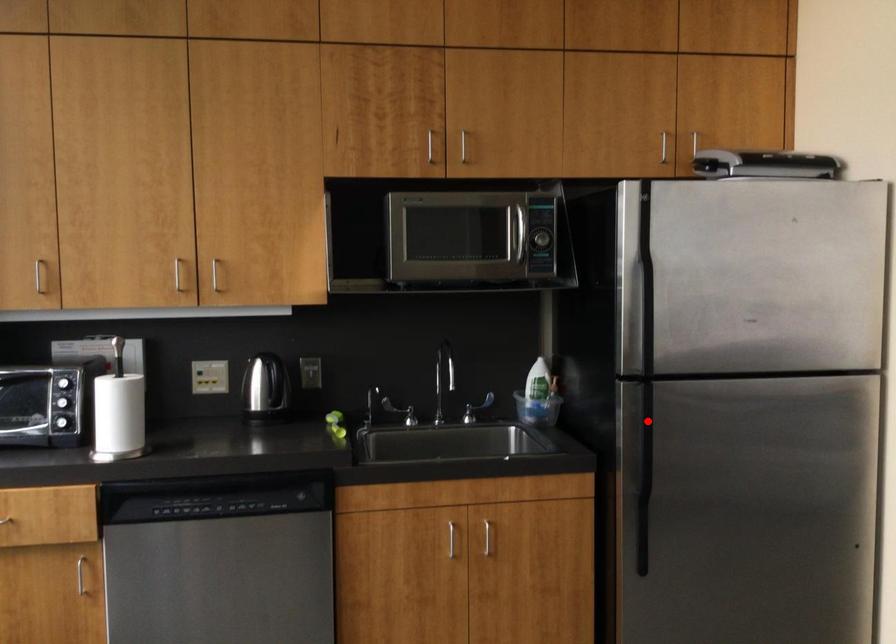
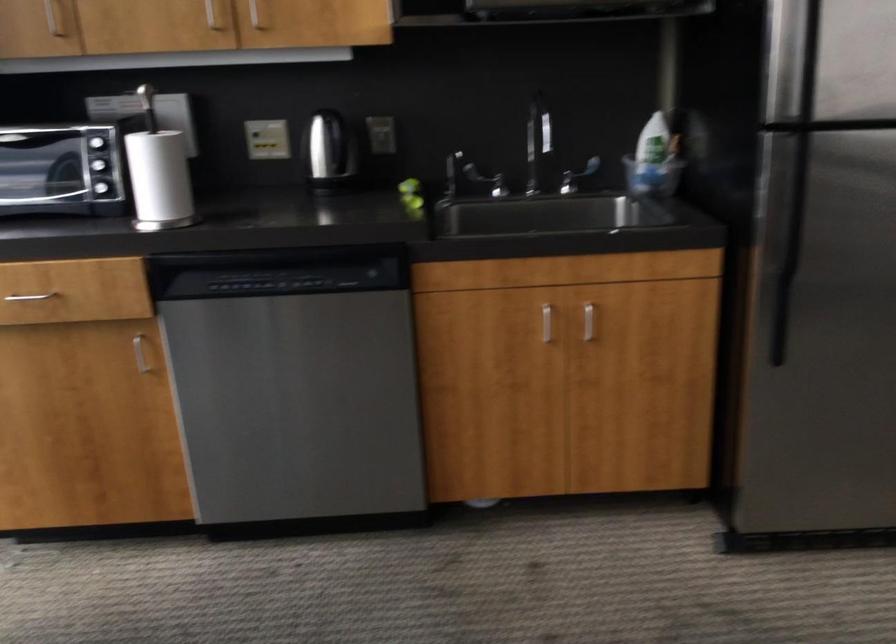
The point at the highlighted location is marked in the first image. Where is the corresponding point in the second image?

(797, 181)